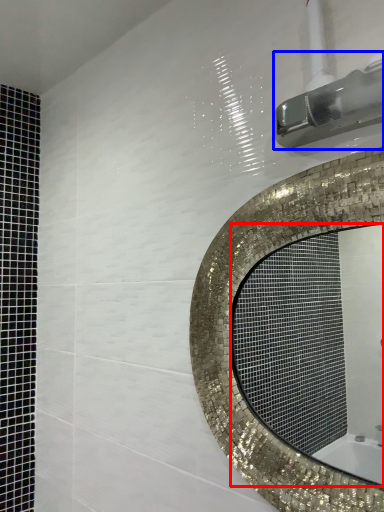
Question: Among these objects, which one is nearest to the camera, mirror (highlighted by a red box) or shower (highlighted by a blue box)?

Choices:
 (A) mirror
 (B) shower

Answer: (B)